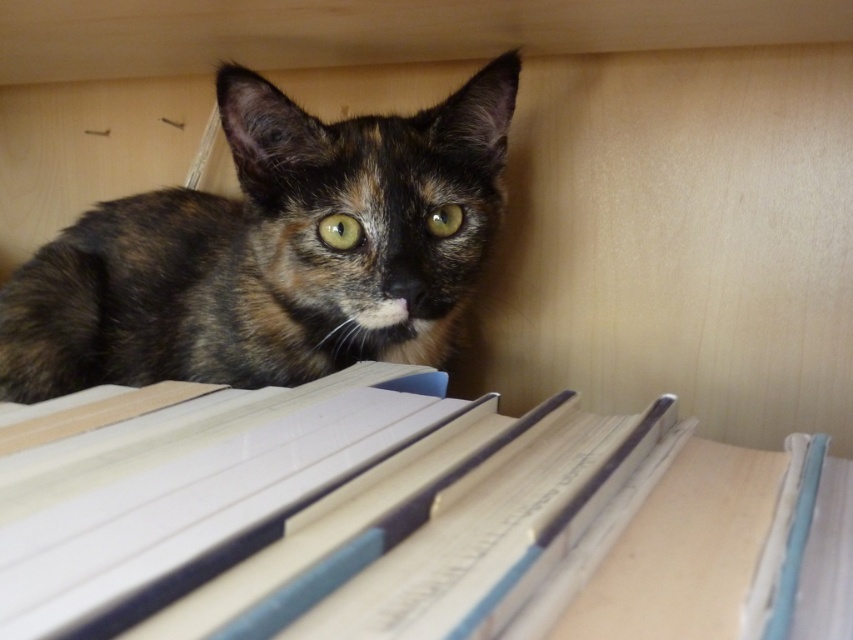
You are standing in front of a bookshelf where a tortoiseshell cat is partially hidden behind some books. There are two points marked on the shelf at coordinates point (x=270, y=573) and point (x=170, y=321). Which of these points is closer to you?

Point (x=270, y=573) is closer to the viewer than point (x=170, y=321).

You are a photographer trying to capture the tortoiseshell fur cat at upper center. The hardcover book at center is blocking part of the cat. Can you move the book to get a clearer shot?

The hardcover book at center is below the tortoiseshell fur cat at upper center, so moving the book would not obstruct the cat anymore. Yes, you can move the book to get a clearer shot.

You are a librarian who wants to reshelve a book. You see the hardcover book at center and the tortoiseshell fur cat at upper center. Which object is positioned to the right side of the other?

The hardcover book at center is to the right of the tortoiseshell fur cat at upper center.